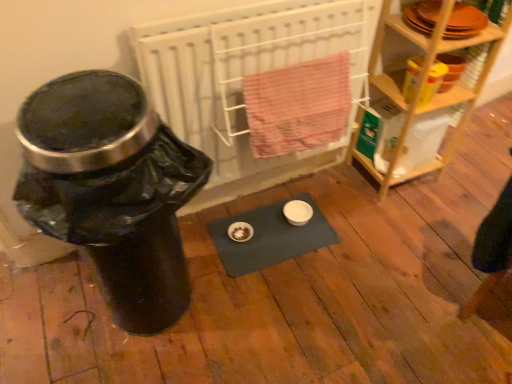
Where is `blue fabric yoga mat at center`? Image resolution: width=512 pixels, height=384 pixels. blue fabric yoga mat at center is located at coordinates (270, 237).

Describe the element at coordinates (111, 190) in the screenshot. I see `black plastic water cooler at left` at that location.

Identify the location of wooden shelf at right. (422, 88).

Where is `blue fabric yoga mat at center`? blue fabric yoga mat at center is located at coordinates (270, 237).

Is black plastic water cooler at left thinner than wooden shelf at right?

No, black plastic water cooler at left is not thinner than wooden shelf at right.

Is black plastic water cooler at left bigger or smaller than wooden shelf at right?

black plastic water cooler at left is bigger than wooden shelf at right.

This screenshot has width=512, height=384. I want to click on water cooler that appears in front of the wooden shelf at right, so click(111, 190).

From a real-world perspective, who is located lower, black plastic water cooler at left or wooden shelf at right?

From a 3D spatial view, black plastic water cooler at left is below.

Considering the positions of point (201, 141) and point (267, 227), is point (201, 141) closer or farther from the camera than point (267, 227)?

Point (201, 141) is closer to the camera than point (267, 227).

Considering the relative positions of white radiator at center and blue fabric yoga mat at center in the image provided, is white radiator at center to the left of blue fabric yoga mat at center from the viewer's perspective?

Indeed, white radiator at center is positioned on the left side of blue fabric yoga mat at center.

Which of these two, white radiator at center or blue fabric yoga mat at center, is wider?

With larger width is blue fabric yoga mat at center.

From a real-world perspective, is white radiator at center physically below blue fabric yoga mat at center?

No.

Can you see black plastic water cooler at left touching blue fabric yoga mat at center?

black plastic water cooler at left and blue fabric yoga mat at center are not in contact.

Is black plastic water cooler at left situated inside blue fabric yoga mat at center or outside?

The correct answer is: outside.

In the scene shown: Considering the relative positions of black plastic water cooler at left and blue fabric yoga mat at center in the image provided, is black plastic water cooler at left behind blue fabric yoga mat at center?

No.

From the image's perspective, between black plastic water cooler at left and blue fabric yoga mat at center, who is located below?

blue fabric yoga mat at center is shown below in the image.

From a real-world perspective, is white radiator at center below black plastic water cooler at left?

No, from a real-world perspective, white radiator at center is not below black plastic water cooler at left.

You are a GUI agent. You are given a task and a screenshot of the screen. Output one action in this format:
    pyautogui.click(x=<x>, y=<y>)
    Task: Click on the water cooler on the left of white radiator at center
    
    Given the screenshot: What is the action you would take?
    pyautogui.click(x=111, y=190)

Is white radiator at center taller than black plastic water cooler at left?

No, white radiator at center is not taller than black plastic water cooler at left.

Does white radiator at center contain black plastic water cooler at left?

No, black plastic water cooler at left is located outside of white radiator at center.

Can you confirm if blue fabric yoga mat at center is bigger than white radiator at center?

Incorrect, blue fabric yoga mat at center is not larger than white radiator at center.

Which object is positioned more to the left, blue fabric yoga mat at center or white radiator at center?

white radiator at center.

Is blue fabric yoga mat at center facing away from white radiator at center?

No, blue fabric yoga mat at center is not facing the opposite direction of white radiator at center.

Considering the sizes of blue fabric yoga mat at center and white radiator at center in the image, is blue fabric yoga mat at center wider or thinner than white radiator at center?

Considering their sizes, blue fabric yoga mat at center looks broader than white radiator at center.

From a real-world perspective, is blue fabric yoga mat at center on black plastic water cooler at left?

Incorrect, from a real-world perspective, blue fabric yoga mat at center is lower than black plastic water cooler at left.

Is blue fabric yoga mat at center next to black plastic water cooler at left and touching it?

blue fabric yoga mat at center and black plastic water cooler at left are not in contact.

From the image's perspective, which is above, blue fabric yoga mat at center or black plastic water cooler at left?

From the image's view, black plastic water cooler at left is above.

Would you say blue fabric yoga mat at center is outside black plastic water cooler at left?

Yes, blue fabric yoga mat at center is outside of black plastic water cooler at left.

Is black plastic water cooler at left taller than white radiator at center?

Correct, black plastic water cooler at left is much taller as white radiator at center.

What are the coordinates of `wide on the right side of black plastic water cooler at left` in the screenshot? It's located at (244, 76).

Considering the points (103, 100) and (180, 27), which point is behind, point (103, 100) or point (180, 27)?

Point (180, 27)

Identify the location of water cooler that is in front of the wooden shelf at right. This screenshot has width=512, height=384. (111, 190).

The height and width of the screenshot is (384, 512). There is a blue fabric yoga mat at center. Identify the location of wide above it (from a real-world perspective). [244, 76].

From the image, which object appears to be nearer to blue fabric yoga mat at center, white radiator at center or wooden shelf at right?

white radiator at center.

From the image, which object appears to be farther from black plastic water cooler at left, blue fabric yoga mat at center or wooden shelf at right?

wooden shelf at right is further to black plastic water cooler at left.

From the image, which object appears to be nearer to white radiator at center, blue fabric yoga mat at center or black plastic water cooler at left?

Among the two, blue fabric yoga mat at center is located nearer to white radiator at center.

Based on the photo, which object lies nearer to the anchor point wooden shelf at right, white radiator at center or blue fabric yoga mat at center?

Among the two, white radiator at center is located nearer to wooden shelf at right.

When comparing their distances from black plastic water cooler at left, does blue fabric yoga mat at center or white radiator at center seem closer?

white radiator at center lies closer to black plastic water cooler at left than the other object.

From the image, which object appears to be nearer to blue fabric yoga mat at center, white radiator at center or black plastic water cooler at left?

Based on the image, white radiator at center appears to be nearer to blue fabric yoga mat at center.

Considering their positions, is wooden shelf at right positioned further to blue fabric yoga mat at center than black plastic water cooler at left?

Based on the image, wooden shelf at right appears to be further to blue fabric yoga mat at center.

When comparing their distances from black plastic water cooler at left, does white radiator at center or blue fabric yoga mat at center seem closer?

white radiator at center is closer to black plastic water cooler at left.

In order to click on wide between black plastic water cooler at left and wooden shelf at right in the horizontal direction in this screenshot , I will do `click(244, 76)`.

Find the location of a particular element. wide between black plastic water cooler at left and blue fabric yoga mat at center in the front-back direction is located at coordinates (244, 76).

You are a GUI agent. You are given a task and a screenshot of the screen. Output one action in this format:
    pyautogui.click(x=<x>, y=<y>)
    Task: Click on the yoga mat located between black plastic water cooler at left and wooden shelf at right in the left-right direction
    This screenshot has width=512, height=384.
    Given the screenshot: What is the action you would take?
    pyautogui.click(x=270, y=237)

Image resolution: width=512 pixels, height=384 pixels. Identify the location of yoga mat situated between white radiator at center and wooden shelf at right from left to right. (270, 237).